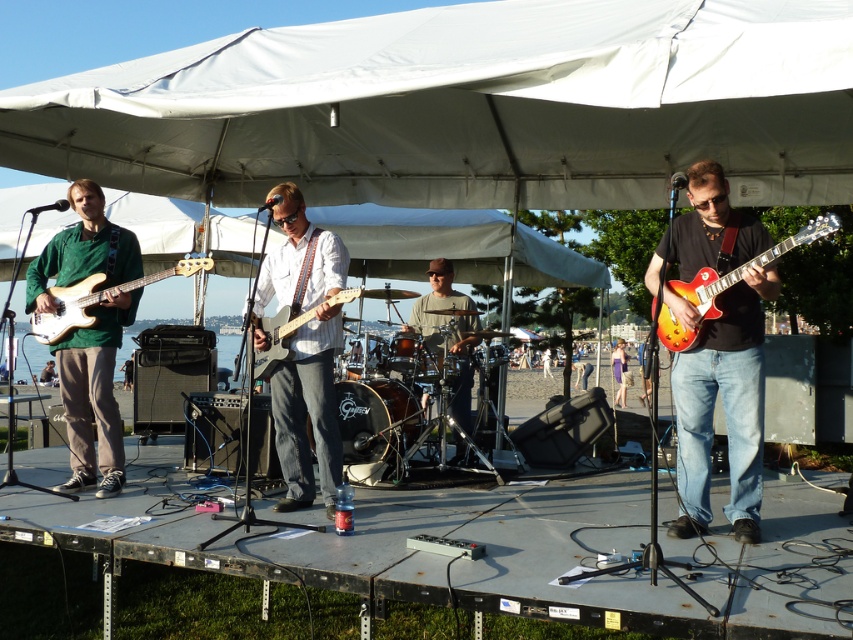
Question: Considering the relative positions of matte black guitar at right and matte gray electric guitar at center in the image provided, where is matte black guitar at right located with respect to matte gray electric guitar at center?

Choices:
 (A) above
 (B) below

Answer: (B)

Question: Based on their relative distances, which object is nearer to the matte white guitar at center?

Choices:
 (A) green matte/glossy sweater at left
 (B) matte white bass guitar at left
 (C) matte black guitar at right
 (D) matte brown drum set at center

Answer: (B)

Question: In this image, where is green matte/glossy sweater at left located relative to matte gray electric guitar at center?

Choices:
 (A) left
 (B) right

Answer: (A)

Question: Which object is closer to the camera taking this photo?

Choices:
 (A) sunburst wood electric guitar at right
 (B) matte black guitar at right
 (C) matte white guitar at center

Answer: (A)

Question: Is matte white bass guitar at left thinner than purple satin dress at center?

Choices:
 (A) yes
 (B) no

Answer: (B)

Question: Which object is positioned closest to the matte white bass guitar at left?

Choices:
 (A) matte white guitar at center
 (B) purple satin dress at center

Answer: (A)